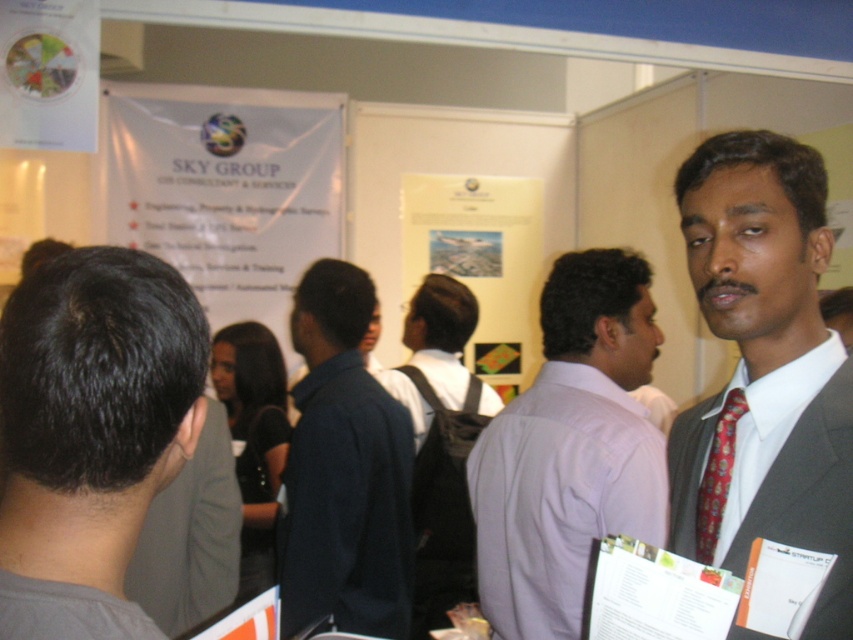
You are a photographer at the event and need to capture a clear photo of the red silk tie at right and the dark gray hair at center. Which object should you focus on first to ensure both are in focus?

The dark gray hair at center is above the red silk tie at right, so focusing on the dark gray hair at center first will ensure both are in focus since it is closer to the camera.

What are the coordinates of the dark gray hair at center?

The dark gray hair at center is located at coordinates point (94, 410).